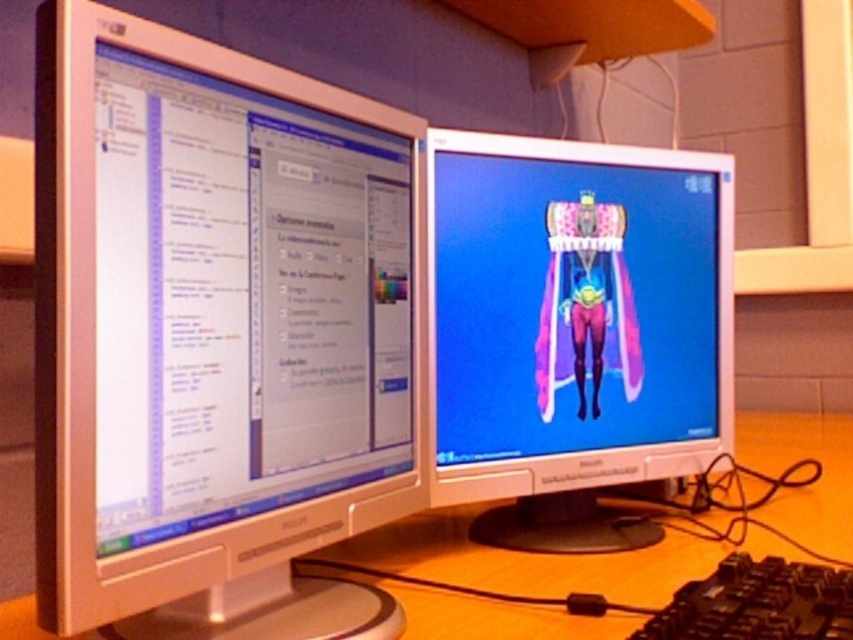
You are a remote worker trying to organize your desk. You have two points marked on your desk at coordinates point(479,628) and point(791,573). If you want to place a new wireless charger between these two points, which point should the charger be closer to so that it is closer to the front of the desk?

The wireless charger should be placed closer to point(479,628) because it is in front of point(791,573).

You need to place a 12 inch wide ruler horizontally between the matte white monitor at left and the matte plastic monitor at center. Will it fit without overlapping either monitor?

The distance between the matte white monitor at left and the matte plastic monitor at center is 10.67 inches. Since the ruler is 12 inches wide, it will not fit without overlapping the monitors because the space is narrower than the ruler.

You are a remote worker who needs to connect a new USB device to the computer. You see the point at coordinates point (213, 333). Is this point on the matte white monitor at left?

The point (213, 333) is on the matte white monitor at left, so yes, the point is on the matte white monitor at left.